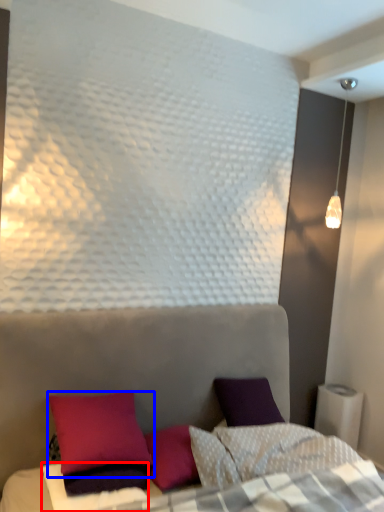
Question: Among these objects, which one is nearest to the camera, sheet (highlighted by a red box) or pillow (highlighted by a blue box)?

Choices:
 (A) sheet
 (B) pillow

Answer: (A)